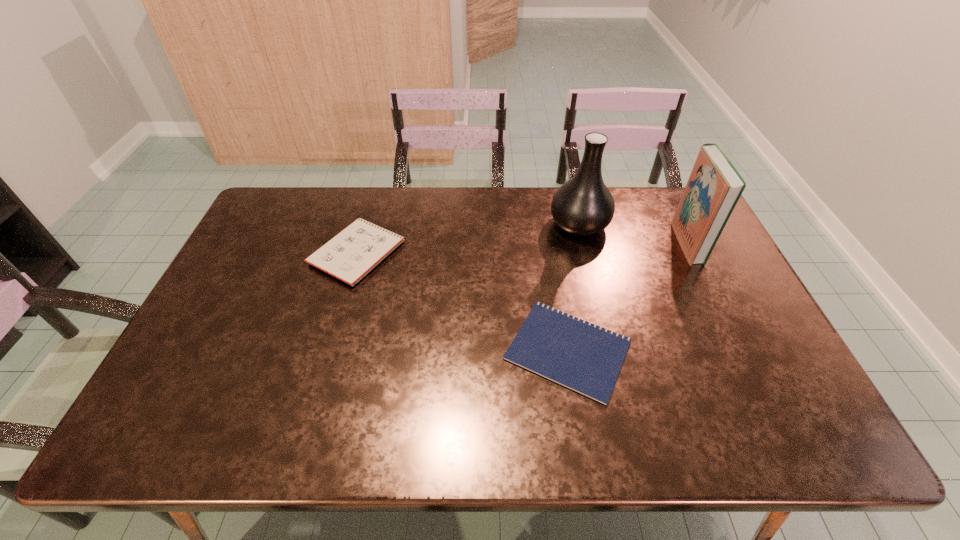
Image resolution: width=960 pixels, height=540 pixels. What are the coordinates of `free area in between the nearer notepad and the left notepad` in the screenshot? It's located at (463, 301).

I want to click on vacant space that's between the vase and the rightmost object, so click(x=633, y=234).

You are a GUI agent. You are given a task and a screenshot of the screen. Output one action in this format:
    pyautogui.click(x=<x>, y=<y>)
    Task: Click on the second closest object relative to the farther notepad
    This screenshot has height=540, width=960.
    Given the screenshot: What is the action you would take?
    pyautogui.click(x=583, y=206)

Locate which object ranks second in proximity to the rightmost object. Please provide its 2D coordinates. Your answer should be formatted as a tuple, i.e. [(x, y)], where the tuple contains the x and y coordinates of a point satisfying the conditions above.

[(581, 356)]

I want to click on free space that satisfies the following two spatial constraints: 1. on the cover of the rightmost object; 2. on the front side of the leftmost object, so click(x=691, y=252).

Where is `free spot that satisfies the following two spatial constraints: 1. on the cover of the hardback book; 2. on the front side of the left notepad`? The image size is (960, 540). free spot that satisfies the following two spatial constraints: 1. on the cover of the hardback book; 2. on the front side of the left notepad is located at coordinates (691, 252).

You are a GUI agent. You are given a task and a screenshot of the screen. Output one action in this format:
    pyautogui.click(x=<x>, y=<y>)
    Task: Click on the free space that satisfies the following two spatial constraints: 1. on the cover of the hardback book; 2. on the front side of the right notepad
    
    Given the screenshot: What is the action you would take?
    click(739, 350)